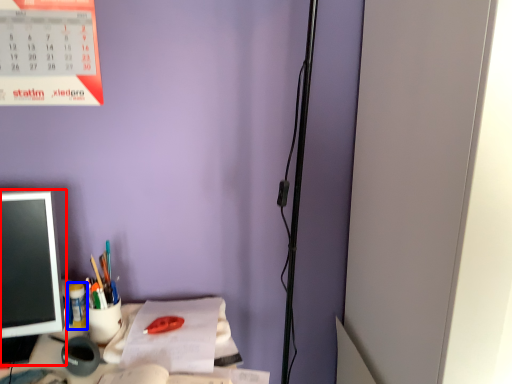
Question: Which object is closer to the camera taking this photo, office supplies (highlighted by a red box) or stationery (highlighted by a blue box)?

Choices:
 (A) office supplies
 (B) stationery

Answer: (A)